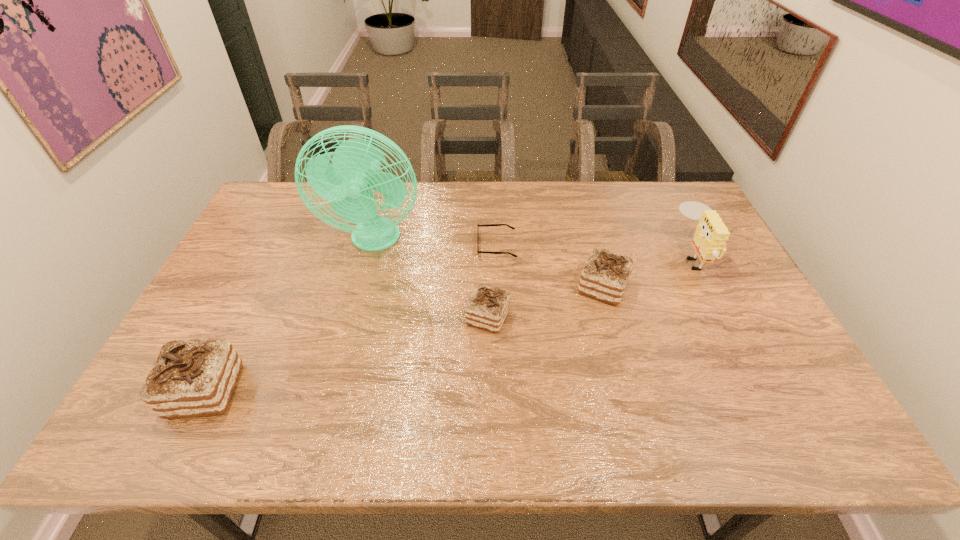
Point out which object is positioned as the fifth nearest to the sunglasses. Please provide its 2D coordinates. Your answer should be formatted as a tuple, i.e. [(x, y)], where the tuple contains the x and y coordinates of a point satisfying the conditions above.

[(191, 378)]

I want to click on object that is the fifth closest one to the rightmost object, so click(x=191, y=378).

What are the coordinates of `the second closest chocolate cake to the shortest chocolate cake` in the screenshot? It's located at (191, 378).

Locate an element on the screen. This screenshot has height=540, width=960. the closest chocolate cake to the fifth object from left to right is located at coordinates pyautogui.click(x=487, y=308).

Locate an element on the screen. This screenshot has height=540, width=960. free space that satisfies the following two spatial constraints: 1. on the front-facing side of the shortest object; 2. on the left side of the rightmost chocolate cake is located at coordinates (498, 287).

Locate an element on the screen. This screenshot has width=960, height=540. free space that satisfies the following two spatial constraints: 1. in front of the rightmost chocolate cake to blow air; 2. on the left side of the fan is located at coordinates point(363,287).

Image resolution: width=960 pixels, height=540 pixels. Identify the location of free space that satisfies the following two spatial constraints: 1. on the front-facing side of the rightmost object; 2. on the front side of the rightmost chocolate cake. (708, 287).